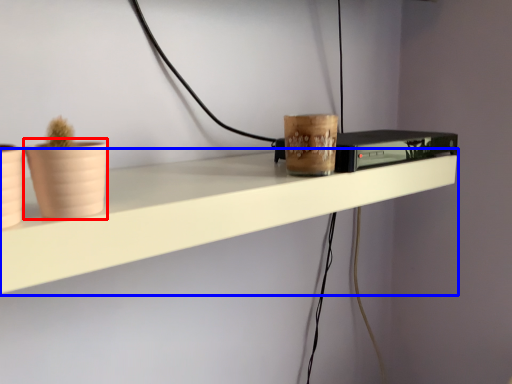
Question: Which object is further to the camera taking this photo, flowerpot (highlighted by a red box) or shelf (highlighted by a blue box)?

Choices:
 (A) flowerpot
 (B) shelf

Answer: (B)